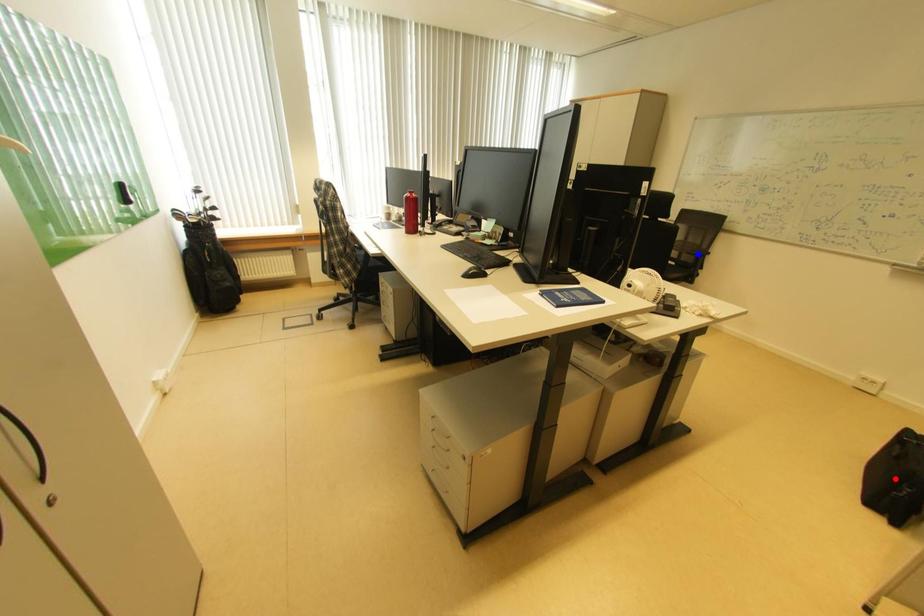
Question: Two points are marked on the image. Which point is closer to the camera?

Choices:
 (A) Blue point is closer.
 (B) Red point is closer.

Answer: (B)